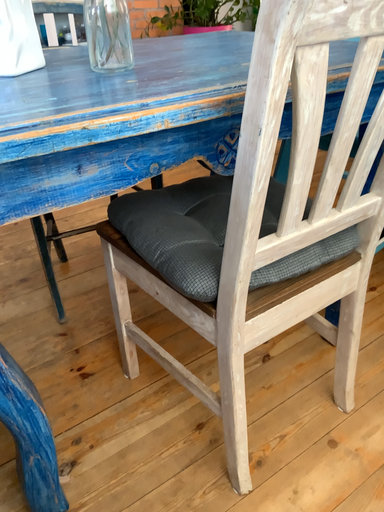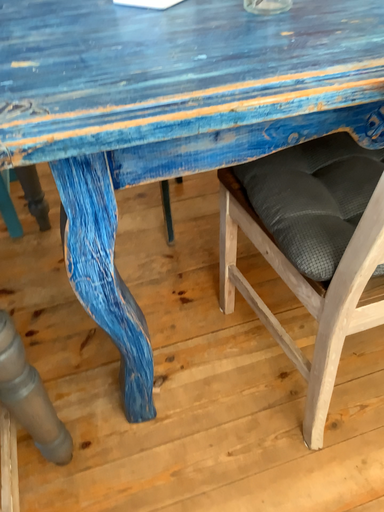
Question: How did the camera likely rotate when shooting the video?

Choices:
 (A) rotated downward
 (B) rotated upward

Answer: (A)